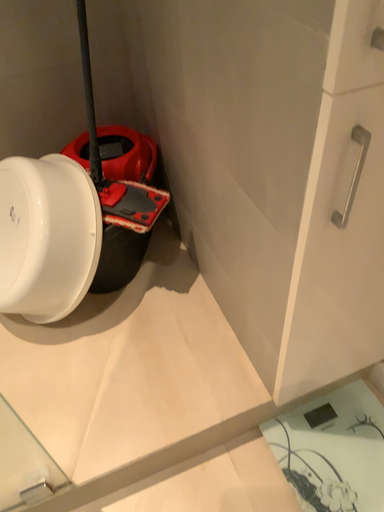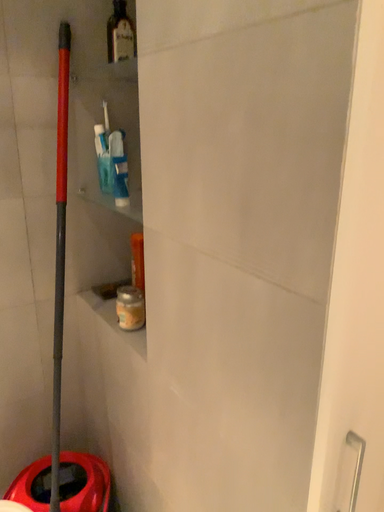
Question: How did the camera likely rotate when shooting the video?

Choices:
 (A) rotated upward
 (B) rotated downward

Answer: (A)